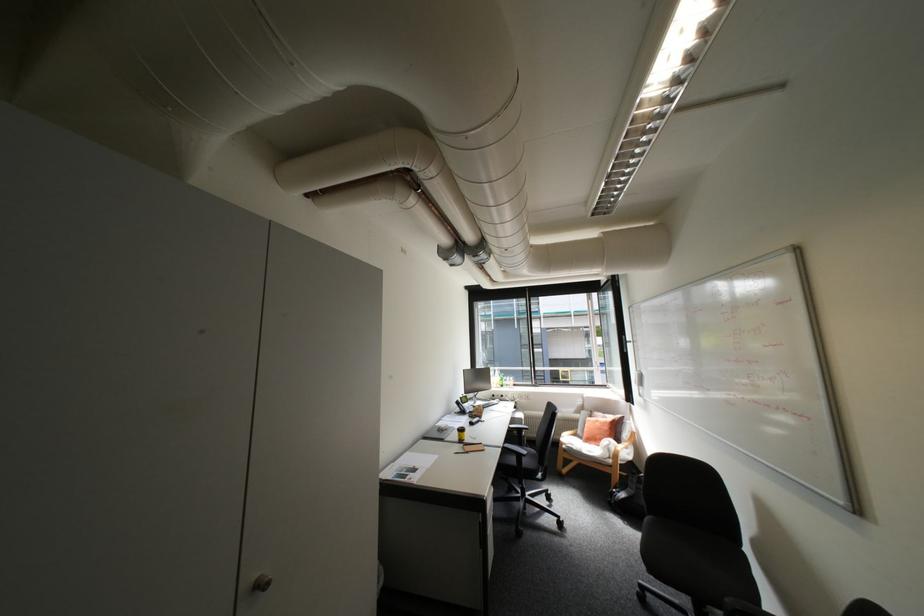
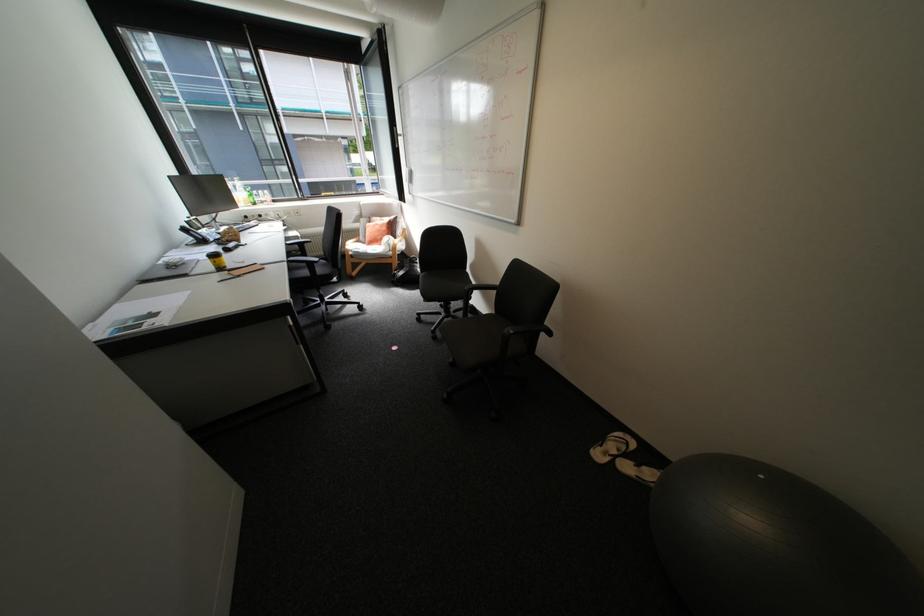
The point at (x=518, y=427) is marked in the first image. Where is the corresponding point in the second image?

(296, 244)